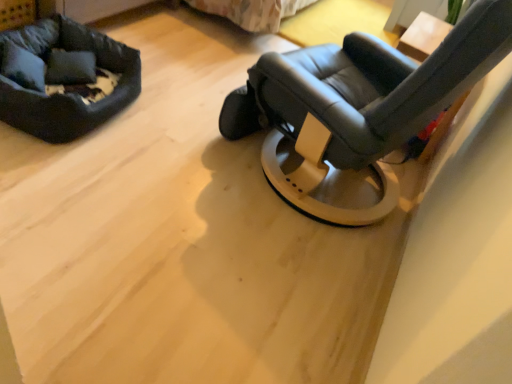
Locate an element on the screen. vacant space that is in between matte black chair at center and soft black fabric dog bed at upper left is located at coordinates (181, 140).